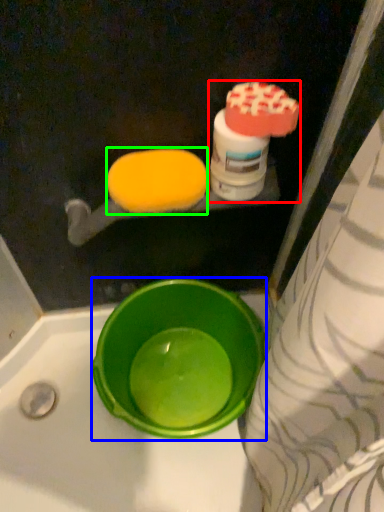
Question: Based on their relative distances, which object is farther from cleaning product (highlighted by a red box)? Choose from basin (highlighted by a blue box) and food (highlighted by a green box).

Choices:
 (A) basin
 (B) food

Answer: (A)